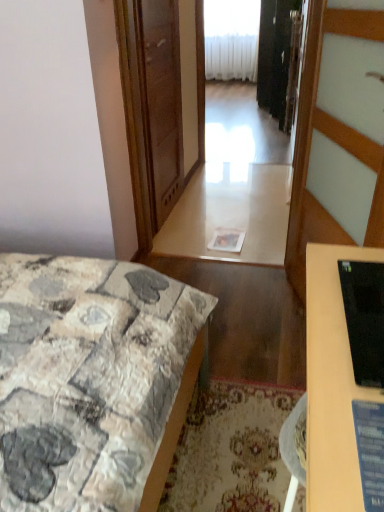
Question: Considering the relative positions of carpeted mat at lower center and patchwork fabric bed at lower left in the image provided, is carpeted mat at lower center to the left or to the right of patchwork fabric bed at lower left?

Choices:
 (A) left
 (B) right

Answer: (B)

Question: Is carpeted mat at lower center inside the boundaries of patchwork fabric bed at lower left, or outside?

Choices:
 (A) inside
 (B) outside

Answer: (A)

Question: Which is farther from the white wood door at center?

Choices:
 (A) carpeted mat at lower center
 (B) transparent glass screen door at center
 (C) black glossy monitor at lower right
 (D) patchwork fabric bed at lower left
 (E) white plastic radiator at upper center

Answer: (E)

Question: Estimate the real-world distances between objects in this image. Which object is closer to the white wood door at center?

Choices:
 (A) transparent glass screen door at center
 (B) black glossy monitor at lower right
 (C) white plastic radiator at upper center
 (D) white glossy table at center
 (E) black glossy monitor at right

Answer: (D)